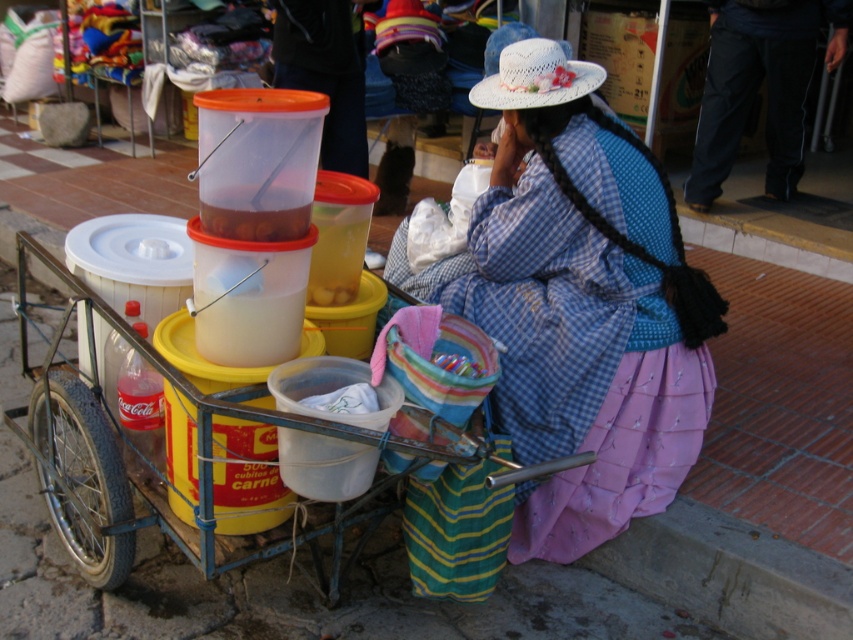
You are a tourist visiting this street vendor. You notice the blue plaid dress at center and the white woven hat at upper center. Which object is positioned lower in the image?

The blue plaid dress at center is positioned below the white woven hat at upper center, so the blue plaid dress at center is lower in the image.

You are a customer standing at the edge of the street vendor area. You see the plastic cart at center and the black cotton pants at lower right. Which object is closer to the ground?

The plastic cart at center is closer to the ground because it is positioned below the black cotton pants at lower right.

What is located at the coordinates point (207, 460) in the image?

The plastic cart at center is located at point (207, 460).